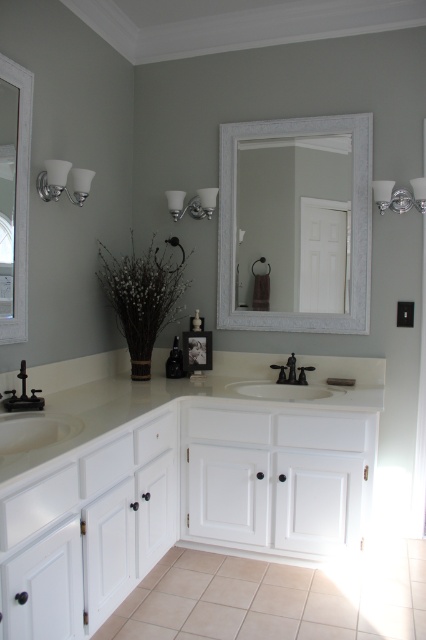
Between point (319, 397) and point (293, 378), which one is positioned in front?

Point (319, 397)

Which of these two, matte black faucet at center or polished bronze faucet at center, stands shorter?

With less height is polished bronze faucet at center.

Who is more distant from viewer, (304, 387) or (293, 365)?

The point (293, 365) is behind.

Find the location of `matte black faucet at center`. matte black faucet at center is located at coordinates (290, 385).

Can you confirm if black matte faucet at lower left is taller than polished bronze faucet at center?

Yes, black matte faucet at lower left is taller than polished bronze faucet at center.

Can you confirm if black matte faucet at lower left is smaller than polished bronze faucet at center?

Actually, black matte faucet at lower left might be larger than polished bronze faucet at center.

Between point (26, 376) and point (287, 376), which one is positioned in front?

Positioned in front is point (26, 376).

The width and height of the screenshot is (426, 640). Identify the location of black matte faucet at lower left. (23, 396).

From the picture: Who is more distant from viewer, (x=322, y=365) or (x=23, y=404)?

The point (x=322, y=365) is behind.

Can you confirm if white glossy countertop at center is wider than black matte faucet at lower left?

Yes.

From the picture: Measure the distance between white glossy countertop at center and camera.

white glossy countertop at center and camera are 1.46 meters apart.

At what (x,y) coordinates should I click in order to perform the action: click on white glossy countertop at center. Please return your answer as a coordinate pair (x, y). The height and width of the screenshot is (640, 426). Looking at the image, I should click on (172, 397).